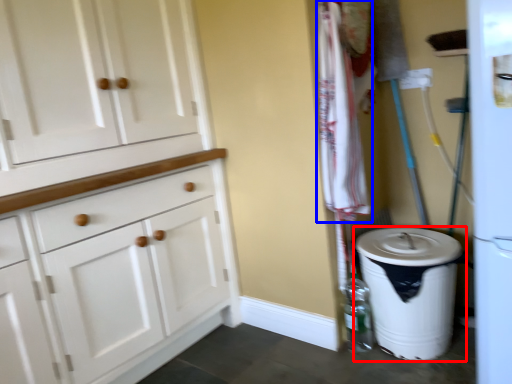
Question: Among these objects, which one is nearest to the camera, waste container (highlighted by a red box) or laundry (highlighted by a blue box)?

Choices:
 (A) waste container
 (B) laundry

Answer: (B)